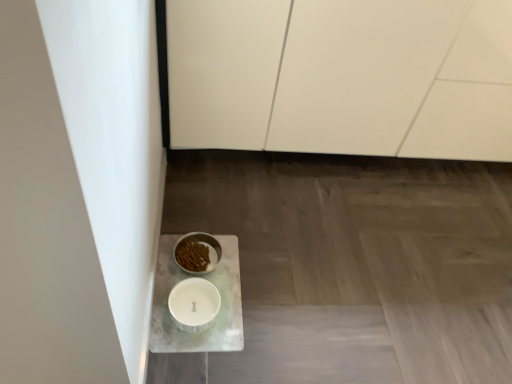
Image resolution: width=512 pixels, height=384 pixels. Find the location of `free space behind white marble tray at lower left`. free space behind white marble tray at lower left is located at coordinates point(228,213).